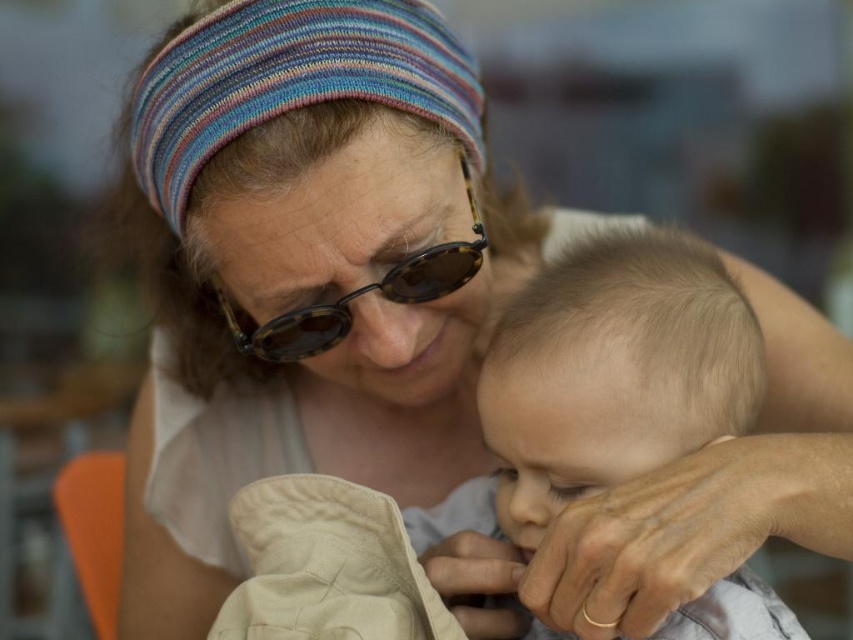
You are a fashion designer observing the image. You need to decide which item is more suitable for a closeup photo shoot focusing on texture details. Which item between the smooth beige shirt at center and the tortoiseshell sunglasses at center would you choose and why?

The smooth beige shirt at center is larger in size than the tortoiseshell sunglasses at center, so it would be more suitable for a closeup photo shoot focusing on texture details because its larger size allows for better visibility and detailed examination of the fabric texture.

You are standing at the point with coordinates point (428, 534) and want to see the point point (440, 294). Can you see it without moving?

Point (428, 534) is behind point (440, 294), so you cannot see it from your current position.